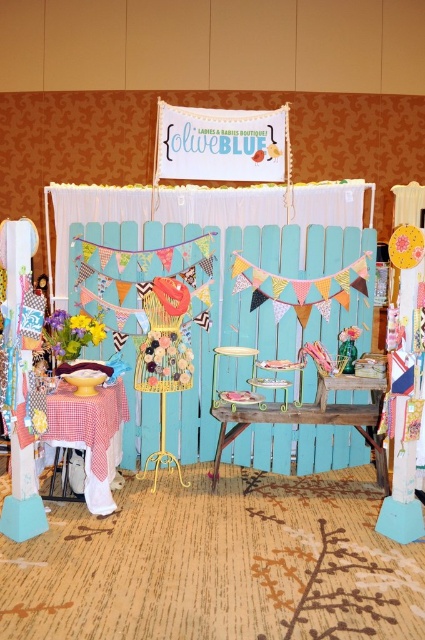
Who is more distant from viewer, (x=105, y=445) or (x=271, y=412)?

Point (x=271, y=412)

Is point (76, 428) behind point (312, 404)?

No, it is in front of (312, 404).

The width and height of the screenshot is (425, 640). What are the coordinates of `checkered fabric table at lower left` in the screenshot? It's located at (90, 436).